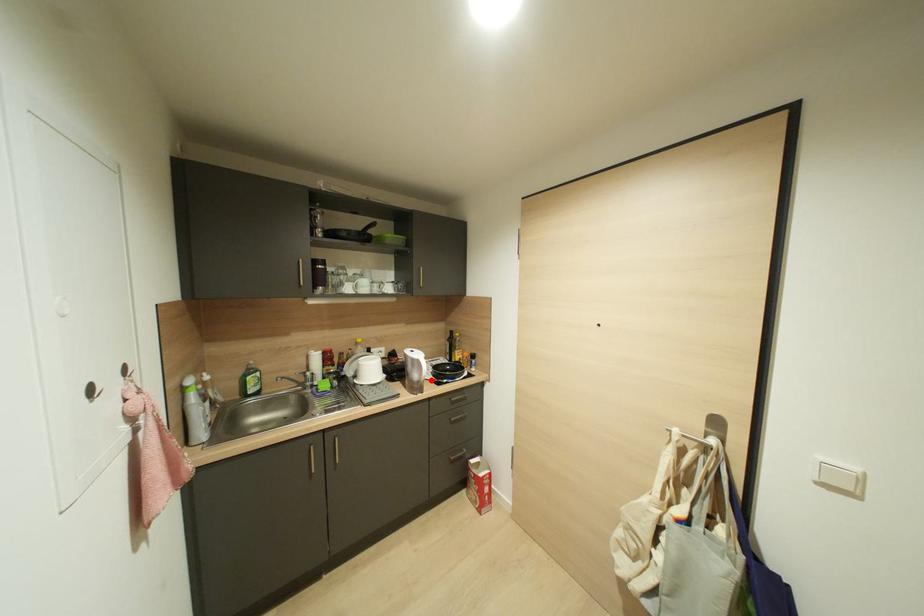
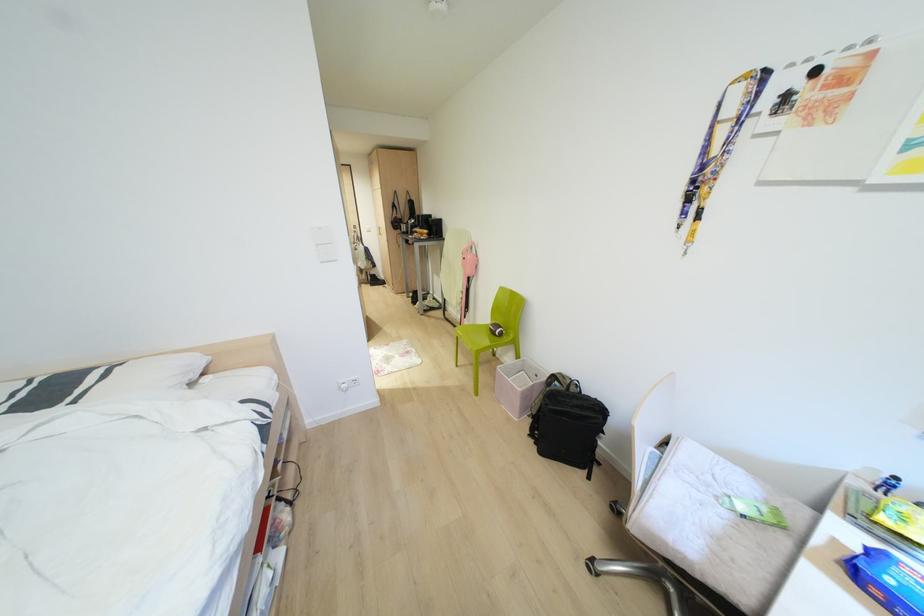
Question: I am providing you with two images of the same scene from different viewpoints. A red point is marked on the first image. Is the red point's position out of view in image 2?

Choices:
 (A) Yes
 (B) No

Answer: (A)